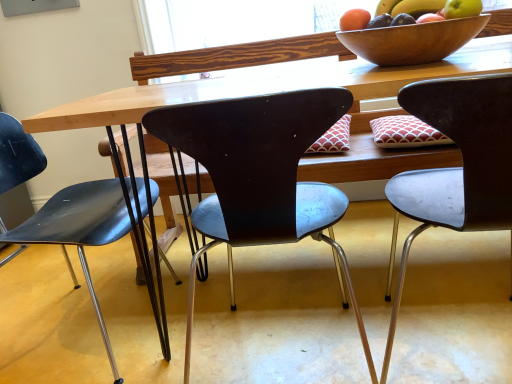
In order to click on matte black chair at center, which is the second chair in left-to-right order in this screenshot , I will do click(x=258, y=175).

Is orange matte grapefruit at upper right spatially inside metallic gray chair at right, which appears as the third chair when viewed from the left, or outside of it?

orange matte grapefruit at upper right cannot be found inside metallic gray chair at right, which appears as the third chair when viewed from the left.

In the scene shown: Can you tell me how much orange matte grapefruit at upper right and metallic gray chair at right, which appears as the third chair when viewed from the left, differ in facing direction?

The angle between the facing direction of orange matte grapefruit at upper right and the facing direction of metallic gray chair at right, which appears as the third chair when viewed from the left, is 93.6 degrees.

From a real-world perspective, between orange matte grapefruit at upper right and metallic gray chair at right, which appears as the third chair when viewed from the left, who is vertically higher?

orange matte grapefruit at upper right is physically above.

From the image's perspective, is orange matte grapefruit at upper right below matte black chair at center, which is the second chair in left-to-right order?

Actually, orange matte grapefruit at upper right appears above matte black chair at center, which is the second chair in left-to-right order, in the image.

Considering the relative sizes of orange matte grapefruit at upper right and matte black chair at center, which is the second chair in left-to-right order, in the image provided, is orange matte grapefruit at upper right bigger than matte black chair at center, which is the second chair in left-to-right order,?

No.

From a real-world perspective, which is physically above, orange matte grapefruit at upper right or matte black chair at center, which is the second chair in left-to-right order?

orange matte grapefruit at upper right.

What's the angular difference between orange matte grapefruit at upper right and matte black chair at center, the second chair positioned from the right,'s facing directions?

The angular difference between orange matte grapefruit at upper right and matte black chair at center, the second chair positioned from the right, is 93.6 degrees.

From a real-world perspective, which is physically above, matte black chair at center, the second chair positioned from the right, or orange matte grapefruit at upper right?

orange matte grapefruit at upper right.

Which object is more forward, matte black chair at center, the second chair positioned from the right, or orange matte grapefruit at upper right?

Positioned in front is matte black chair at center, the second chair positioned from the right.

Considering the points (278, 169) and (413, 8), which point is in front, point (278, 169) or point (413, 8)?

The point (278, 169) is in front.

How far apart are matte black chair at center, which is the second chair in left-to-right order, and matte black chair at center, which is counted as the 3th chair, starting from the right?

They are 19.03 inches apart.

Is matte black chair at center, the second chair positioned from the right, completely or partially outside of matte black chair at center, which is counted as the 3th chair, starting from the right?

Absolutely, matte black chair at center, the second chair positioned from the right, is external to matte black chair at center, which is counted as the 3th chair, starting from the right.

In the scene shown: From the image's perspective, is matte black chair at center, which is the second chair in left-to-right order, on top of matte black chair at center, which is the first chair from left to right?

Correct, matte black chair at center, which is the second chair in left-to-right order, appears higher than matte black chair at center, which is the first chair from left to right, in the image.

Consider the image. Is matte black chair at center, the second chair positioned from the right, positioned far away from matte black chair at center, which is the first chair from left to right?

No, matte black chair at center, the second chair positioned from the right, is not far from matte black chair at center, which is the first chair from left to right.

From the image's perspective, who appears lower, wooden bowl at upper right or matte black chair at center, the second chair positioned from the right?

matte black chair at center, the second chair positioned from the right, is shown below in the image.

Considering the relative positions of wooden bowl at upper right and matte black chair at center, the second chair positioned from the right, in the image provided, is wooden bowl at upper right to the right of matte black chair at center, the second chair positioned from the right, from the viewer's perspective?

Indeed, wooden bowl at upper right is positioned on the right side of matte black chair at center, the second chair positioned from the right.

Is wooden bowl at upper right touching matte black chair at center, which is the second chair in left-to-right order?

No, wooden bowl at upper right is not touching matte black chair at center, which is the second chair in left-to-right order.

From the picture: Is matte black chair at center, which is the second chair in left-to-right order, located within wooden bowl at upper right?

No, matte black chair at center, which is the second chair in left-to-right order, is located outside of wooden bowl at upper right.

Is point (197, 260) behind point (362, 15)?

Yes, point (197, 260) is behind point (362, 15).

Considering the sizes of objects matte black chair at center, the second chair positioned from the right, and matte orange at upper right in the image provided, who is thinner, matte black chair at center, the second chair positioned from the right, or matte orange at upper right?

Thinner between the two is matte orange at upper right.

Based on their positions, is matte black chair at center, which is the second chair in left-to-right order, located to the left or right of matte orange at upper right?

Based on their positions, matte black chair at center, which is the second chair in left-to-right order, is located to the left of matte orange at upper right.

Considering the sizes of matte black chair at center, the second chair positioned from the right, and matte orange at upper right in the image, is matte black chair at center, the second chair positioned from the right, bigger or smaller than matte orange at upper right?

Clearly, matte black chair at center, the second chair positioned from the right, is larger in size than matte orange at upper right.

Where is `chair above the matte black chair at center, which is the second chair in left-to-right order (from the image's perspective)`? The width and height of the screenshot is (512, 384). chair above the matte black chair at center, which is the second chair in left-to-right order (from the image's perspective) is located at coordinates (457, 167).

In terms of size, does metallic gray chair at right, which is the 1th chair in right-to-left order, appear bigger or smaller than matte black chair at center, which is the second chair in left-to-right order?

In the image, metallic gray chair at right, which is the 1th chair in right-to-left order, appears to be smaller than matte black chair at center, which is the second chair in left-to-right order.

From a real-world perspective, is metallic gray chair at right, which is the 1th chair in right-to-left order, under matte black chair at center, the second chair positioned from the right?

Yes, from a real-world perspective, metallic gray chair at right, which is the 1th chair in right-to-left order, is beneath matte black chair at center, the second chair positioned from the right.

Considering the sizes of metallic gray chair at right, which appears as the third chair when viewed from the left, and matte black chair at center, which is the second chair in left-to-right order, in the image, is metallic gray chair at right, which appears as the third chair when viewed from the left, taller or shorter than matte black chair at center, which is the second chair in left-to-right order,?

Clearly, metallic gray chair at right, which appears as the third chair when viewed from the left, is shorter compared to matte black chair at center, which is the second chair in left-to-right order.

This screenshot has width=512, height=384. In order to click on grapefruit above the metallic gray chair at right, which is the 1th chair in right-to-left order (from the image's perspective) in this screenshot , I will do `click(438, 9)`.

The image size is (512, 384). In order to click on grapefruit located behind the matte black chair at center, the second chair positioned from the right in this screenshot , I will do tap(438, 9).

Considering their positions, is matte orange at upper right positioned further to wooden bowl at upper right than matte black chair at center, which is counted as the 3th chair, starting from the right?

matte black chair at center, which is counted as the 3th chair, starting from the right, is positioned further to the anchor wooden bowl at upper right.

Estimate the real-world distances between objects in this image. Which object is closer to wooden bowl at upper right, matte black chair at center, which is the second chair in left-to-right order, or metallic gray chair at right, which appears as the third chair when viewed from the left?

Among the two, metallic gray chair at right, which appears as the third chair when viewed from the left, is located nearer to wooden bowl at upper right.

Looking at the image, which one is located closer to metallic gray chair at right, which is the 1th chair in right-to-left order, wooden bowl at upper right or matte orange at upper right?

wooden bowl at upper right lies closer to metallic gray chair at right, which is the 1th chair in right-to-left order, than the other object.

Considering their positions, is wooden bowl at upper right positioned further to matte black chair at center, the second chair positioned from the right, than orange matte grapefruit at upper right?

Among the two, orange matte grapefruit at upper right is located further to matte black chair at center, the second chair positioned from the right.

Looking at the image, which one is located closer to matte orange at upper right, orange matte grapefruit at upper right or matte black chair at center, the second chair positioned from the right?

Among the two, orange matte grapefruit at upper right is located nearer to matte orange at upper right.

Estimate the real-world distances between objects in this image. Which object is further from wooden bowl at upper right, matte black chair at center, the second chair positioned from the right, or matte black chair at center, which is the first chair from left to right?

matte black chair at center, which is the first chair from left to right, lies further to wooden bowl at upper right than the other object.

Estimate the real-world distances between objects in this image. Which object is further from matte orange at upper right, matte black chair at center, which is the second chair in left-to-right order, or orange matte grapefruit at upper right?

matte black chair at center, which is the second chair in left-to-right order.

Considering their positions, is metallic gray chair at right, which is the 1th chair in right-to-left order, positioned closer to wooden bowl at upper right than orange matte grapefruit at upper right?

orange matte grapefruit at upper right lies closer to wooden bowl at upper right than the other object.

Locate an element on the screen. This screenshot has height=384, width=512. chair between wooden bowl at upper right and matte black chair at center, which is the second chair in left-to-right order, vertically is located at coordinates (457, 167).

This screenshot has width=512, height=384. I want to click on bowl between matte orange at upper right and matte black chair at center, which is the second chair in left-to-right order, from top to bottom, so click(412, 41).

Locate an element on the screen. This screenshot has height=384, width=512. bowl between matte orange at upper right and metallic gray chair at right, which is the 1th chair in right-to-left order, in the vertical direction is located at coordinates (412, 41).

I want to click on chair between matte orange at upper right and matte black chair at center, the second chair positioned from the right, from top to bottom, so point(457,167).